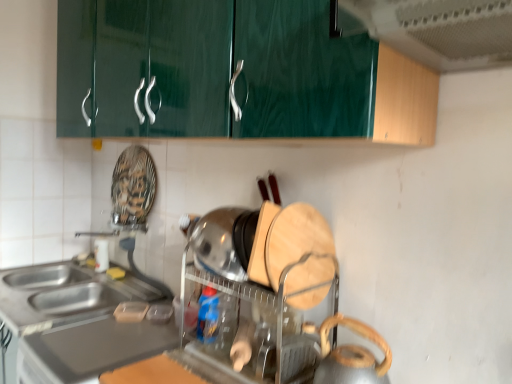
Question: In the image, is metallic silver kettle at lower right, which ranks as the first appliance in front-to-back order, on the left side or the right side of green glossy exhaust hood at upper center?

Choices:
 (A) left
 (B) right

Answer: (A)

Question: Considering the positions of metallic silver kettle at lower right, arranged as the 2th appliance when viewed from the back, and green glossy exhaust hood at upper center in the image, is metallic silver kettle at lower right, arranged as the 2th appliance when viewed from the back, taller or shorter than green glossy exhaust hood at upper center?

Choices:
 (A) tall
 (B) short

Answer: (A)

Question: Which object is positioned closest to the wooden cutting board at center, the first appliance viewed from the back?

Choices:
 (A) green glossy exhaust hood at upper center
 (B) satin silver countertop at lower left
 (C) metallic silver kettle at lower right, arranged as the 2th appliance when viewed from the back

Answer: (C)

Question: Which object is positioned closest to the metallic silver kettle at lower right, which ranks as the first appliance in front-to-back order?

Choices:
 (A) green glossy exhaust hood at upper center
 (B) wooden cutting board at center, marked as the 2th appliance in a front-to-back arrangement
 (C) satin silver countertop at lower left

Answer: (B)